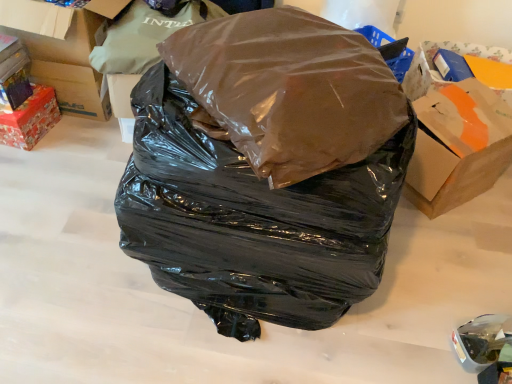
Question: Considering the relative sizes of matte cardboard box at left, the 2th box in the bottom-to-top sequence, and brown matte plastic bag at center, placed as the 1th plastic bag when sorted from bottom to top, in the image provided, is matte cardboard box at left, the 2th box in the bottom-to-top sequence, bigger than brown matte plastic bag at center, placed as the 1th plastic bag when sorted from bottom to top,?

Choices:
 (A) no
 (B) yes

Answer: (A)

Question: Is matte cardboard box at left, placed as the first box when sorted from top to bottom, surrounding brown matte plastic bag at center, placed as the 1th plastic bag when sorted from bottom to top?

Choices:
 (A) yes
 (B) no

Answer: (B)

Question: Is matte cardboard box at left, placed as the first box when sorted from top to bottom, taller than brown matte plastic bag at center, which is counted as the 3th plastic bag, starting from the top?

Choices:
 (A) no
 (B) yes

Answer: (A)

Question: From the image's perspective, would you say matte cardboard box at left, placed as the first box when sorted from top to bottom, is shown under brown matte plastic bag at center, placed as the 1th plastic bag when sorted from bottom to top?

Choices:
 (A) no
 (B) yes

Answer: (A)

Question: From the image's perspective, would you say matte cardboard box at left, the 2th box in the bottom-to-top sequence, is positioned over brown matte plastic bag at center, placed as the 1th plastic bag when sorted from bottom to top?

Choices:
 (A) yes
 (B) no

Answer: (A)

Question: Would you say brown matte plastic bag at center, which is the 2th plastic bag in top-to-bottom order, is to the left or to the right of matte cardboard box at upper left in the picture?

Choices:
 (A) left
 (B) right

Answer: (B)

Question: Considering the positions of point (301, 79) and point (15, 39), is point (301, 79) closer or farther from the camera than point (15, 39)?

Choices:
 (A) closer
 (B) farther

Answer: (A)

Question: From a real-world perspective, relative to matte cardboard box at upper left, is brown matte plastic bag at center, which is counted as the 2th plastic bag, starting from the bottom, vertically above or below?

Choices:
 (A) below
 (B) above

Answer: (B)

Question: Considering the positions of brown matte plastic bag at center, which is the 2th plastic bag in top-to-bottom order, and matte cardboard box at upper left in the image, is brown matte plastic bag at center, which is the 2th plastic bag in top-to-bottom order, bigger or smaller than matte cardboard box at upper left?

Choices:
 (A) big
 (B) small

Answer: (A)

Question: Considering the positions of point (156, 158) and point (39, 84), is point (156, 158) closer or farther from the camera than point (39, 84)?

Choices:
 (A) farther
 (B) closer

Answer: (B)

Question: Considering the positions of brown matte plastic bag at center, placed as the 1th plastic bag when sorted from bottom to top, and shiny metallic box at left, acting as the 2th box starting from the top, in the image, is brown matte plastic bag at center, placed as the 1th plastic bag when sorted from bottom to top, wider or thinner than shiny metallic box at left, acting as the 2th box starting from the top,?

Choices:
 (A) thin
 (B) wide

Answer: (B)

Question: From a real-world perspective, is brown matte plastic bag at center, which is counted as the 3th plastic bag, starting from the top, positioned above or below shiny metallic box at left, the first box in the bottom-to-top sequence?

Choices:
 (A) above
 (B) below

Answer: (A)

Question: From the image's perspective, relative to shiny metallic box at left, the first box in the bottom-to-top sequence, is brown matte plastic bag at center, placed as the 1th plastic bag when sorted from bottom to top, above or below?

Choices:
 (A) below
 (B) above

Answer: (A)

Question: From the image's perspective, relative to brown matte plastic bag at center, placed as the 1th plastic bag when sorted from bottom to top, is matte cardboard box at upper left above or below?

Choices:
 (A) below
 (B) above

Answer: (B)

Question: Considering the positions of matte cardboard box at upper left and brown matte plastic bag at center, placed as the 1th plastic bag when sorted from bottom to top, in the image, is matte cardboard box at upper left taller or shorter than brown matte plastic bag at center, placed as the 1th plastic bag when sorted from bottom to top,?

Choices:
 (A) tall
 (B) short

Answer: (B)